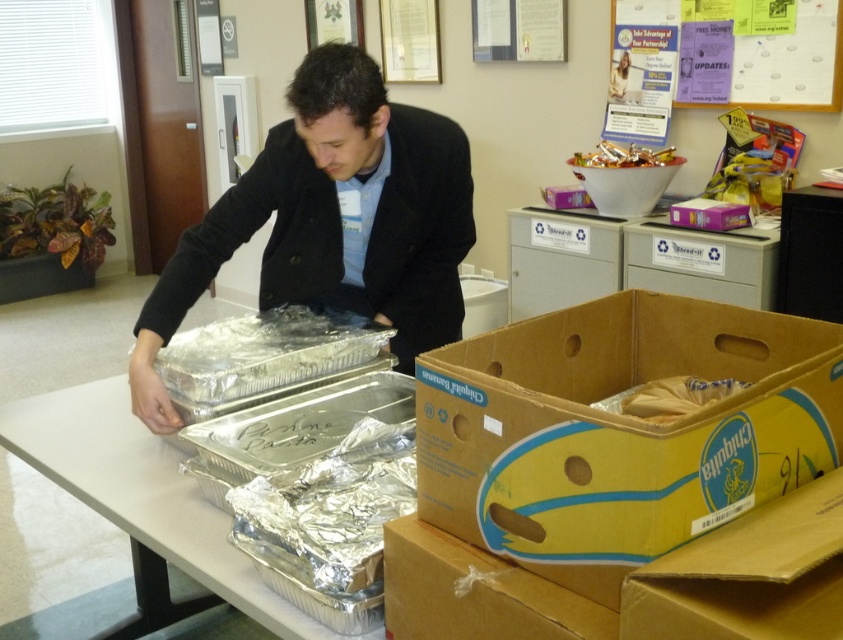
Is matte black jacket at center smaller than matte paper bulletin board at upper right?

Actually, matte black jacket at center might be larger than matte paper bulletin board at upper right.

Which is more to the left, matte black jacket at center or matte paper bulletin board at upper right?

From the viewer's perspective, matte black jacket at center appears more on the left side.

At what (x,y) coordinates should I click in order to perform the action: click on matte black jacket at center. Please return your answer as a coordinate pair (x, y). Looking at the image, I should click on (331, 220).

Does matte paper bulletin board at upper right appear on the right side of metallic shiny candy at upper center?

Indeed, matte paper bulletin board at upper right is positioned on the right side of metallic shiny candy at upper center.

Between point (642, 20) and point (572, 157), which one is positioned in front?

Positioned in front is point (642, 20).

The height and width of the screenshot is (640, 843). I want to click on matte paper bulletin board at upper right, so (x=790, y=65).

Can you confirm if silver aluminum trays at center is bigger than matte paper bulletin board at upper right?

Correct, silver aluminum trays at center is larger in size than matte paper bulletin board at upper right.

Is point (159, 531) more distant than point (819, 64)?

No, (159, 531) is in front of (819, 64).

Identify the location of silver aluminum trays at center. (143, 500).